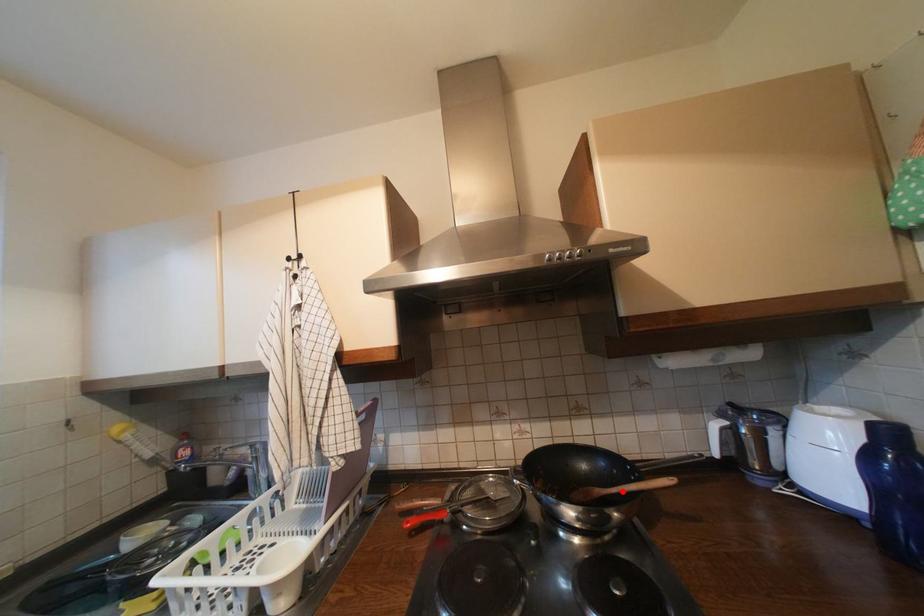
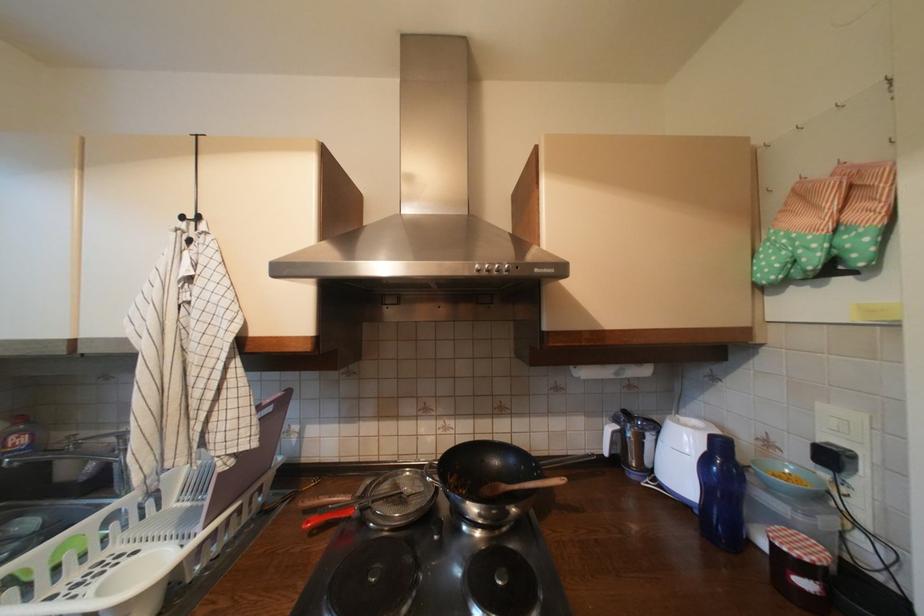
In the second image, find the point that corresponds to the highlighted location in the first image.

(525, 488)